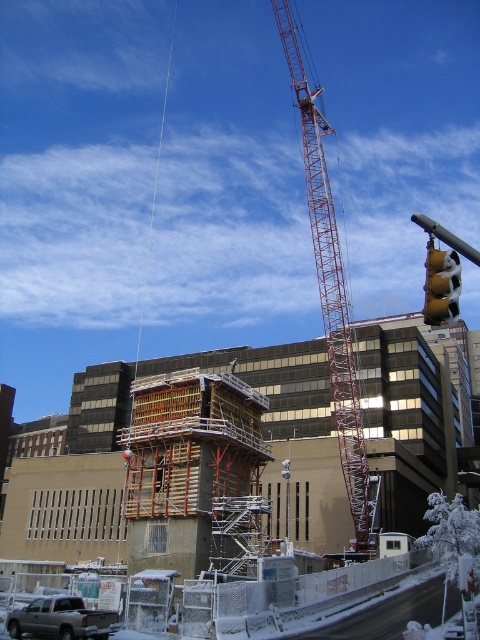
You are a construction worker standing at the entrance of the construction site. You need to move the silver metallic truck at lower left to a different location. Can you drive it directly forward without moving the red metal crane at center first?

The silver metallic truck at lower left is behind the red metal crane at center, so you cannot drive it directly forward without moving the red metal crane at center first because the truck is obstructed by the crane.

You are a construction worker standing at the base of the red metal crane at center. You need to move to a safety zone located 65 meters away from the crane. Can you reach the safety zone without moving closer to the crane?

The distance between the red metal crane at center and the camera is 64.38 meters. Since the safety zone is 65 meters away from the crane, you can reach it without moving closer because 65 meters is farther than the current 64.38 meters distance.